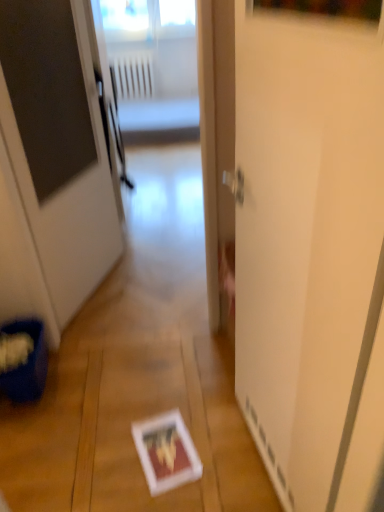
Question: Considering the relative sizes of white glossy screen door at center and white plastic radiator at upper center in the image provided, is white glossy screen door at center wider than white plastic radiator at upper center?

Choices:
 (A) no
 (B) yes

Answer: (A)

Question: Can you confirm if white glossy screen door at center is positioned to the left of white plastic radiator at upper center?

Choices:
 (A) yes
 (B) no

Answer: (B)

Question: Considering the relative sizes of white glossy screen door at center and white plastic radiator at upper center in the image provided, is white glossy screen door at center shorter than white plastic radiator at upper center?

Choices:
 (A) no
 (B) yes

Answer: (A)

Question: Is white glossy screen door at center facing away from white plastic radiator at upper center?

Choices:
 (A) no
 (B) yes

Answer: (A)

Question: Is white glossy screen door at center bigger than white plastic radiator at upper center?

Choices:
 (A) no
 (B) yes

Answer: (B)

Question: Is white glossy screen door at center thinner than white plastic radiator at upper center?

Choices:
 (A) no
 (B) yes

Answer: (B)

Question: Is white glossy door at center turned away from white glossy screen door at center?

Choices:
 (A) no
 (B) yes

Answer: (A)

Question: From the image's perspective, would you say white glossy door at center is positioned over white glossy screen door at center?

Choices:
 (A) no
 (B) yes

Answer: (B)

Question: Is white glossy door at center at the left side of white glossy screen door at center?

Choices:
 (A) no
 (B) yes

Answer: (B)

Question: Can you confirm if white glossy door at center is thinner than white glossy screen door at center?

Choices:
 (A) yes
 (B) no

Answer: (B)

Question: From a real-world perspective, is white glossy door at center located higher than white glossy screen door at center?

Choices:
 (A) yes
 (B) no

Answer: (A)

Question: Is the depth of white glossy door at center greater than that of white glossy screen door at center?

Choices:
 (A) no
 (B) yes

Answer: (B)

Question: Is white glossy screen door at center not close to white glossy door at center?

Choices:
 (A) no
 (B) yes

Answer: (B)